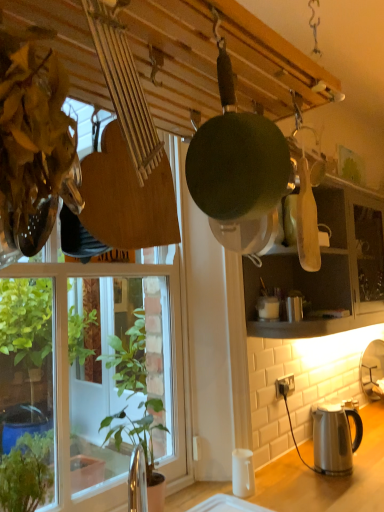
What are the coordinates of `white matte coffee cup at lower right` in the screenshot? It's located at (243, 473).

Measure the distance between satin silver kettle at lower right and camera.

They are 1.62 meters apart.

The image size is (384, 512). What do you see at coordinates (82, 376) in the screenshot? I see `transparent glass window at upper left` at bounding box center [82, 376].

In order to click on green leafy plant at lower left, acting as the first houseplant starting from the front in this screenshot , I will do `click(27, 473)`.

Is matte white cabinet at upper right located outside green matte frying pan at center?

Indeed, matte white cabinet at upper right is completely outside green matte frying pan at center.

Considering the points (273, 282) and (229, 170), which point is in front, point (273, 282) or point (229, 170)?

Positioned in front is point (229, 170).

Is matte white cabinet at upper right turned away from green matte frying pan at center?

No.

Is matte white cabinet at upper right in contact with green matte frying pan at center?

No, matte white cabinet at upper right is not beside green matte frying pan at center.

Is satin silver kettle at lower right touching white matte coffee cup at lower right?

No.

Is satin silver kettle at lower right not within white matte coffee cup at lower right?

That's correct, satin silver kettle at lower right is outside of white matte coffee cup at lower right.

Find the location of a particular element. The height and width of the screenshot is (512, 384). coffee cup located underneath the satin silver kettle at lower right (from a real-world perspective) is located at coordinates (243, 473).

From a real-world perspective, is satin silver kettle at lower right beneath white matte coffee cup at lower right?

Actually, satin silver kettle at lower right is physically above white matte coffee cup at lower right in the real world.

Does satin silver kettle at lower right appear on the right side of white plastic power outlet at lower right?

Correct, you'll find satin silver kettle at lower right to the right of white plastic power outlet at lower right.

Is satin silver kettle at lower right outside of white plastic power outlet at lower right?

Yes, satin silver kettle at lower right is outside of white plastic power outlet at lower right.

Considering the sizes of satin silver kettle at lower right and white plastic power outlet at lower right in the image, is satin silver kettle at lower right wider or thinner than white plastic power outlet at lower right?

satin silver kettle at lower right is wider than white plastic power outlet at lower right.

From the image's perspective, is satin silver kettle at lower right above white plastic power outlet at lower right?

No, from the image's perspective, satin silver kettle at lower right is not over white plastic power outlet at lower right.

Considering the sizes of objects transparent glass window at upper left and matte white cabinet at upper right in the image provided, who is taller, transparent glass window at upper left or matte white cabinet at upper right?

Standing taller between the two is transparent glass window at upper left.

In the image, there is a matte white cabinet at upper right. Where is `window below it (from the image's perspective)`? window below it (from the image's perspective) is located at coordinates (82, 376).

From a real-world perspective, which is physically above, transparent glass window at upper left or matte white cabinet at upper right?

matte white cabinet at upper right, from a real-world perspective.

Considering the positions of point (50, 345) and point (343, 286), is point (50, 345) closer or farther from the camera than point (343, 286)?

Point (50, 345) is positioned farther from the camera compared to point (343, 286).

Which object is thinner, green leafy plant at left, positioned as the second houseplant in front-to-back order, or matte white cabinet at upper right?

Thinner between the two is green leafy plant at left, positioned as the second houseplant in front-to-back order.

Based on their positions, is green leafy plant at left, which ranks as the first houseplant in back-to-front order, located to the left or right of matte white cabinet at upper right?

Based on their positions, green leafy plant at left, which ranks as the first houseplant in back-to-front order, is located to the left of matte white cabinet at upper right.

Is point (128, 361) closer or farther from the camera than point (358, 257)?

Point (128, 361) is positioned farther from the camera compared to point (358, 257).

Does green leafy plant at left, marked as the 1th houseplant in a right-to-left arrangement, have a larger size compared to matte white cabinet at upper right?

No.

Does white matte coffee cup at lower right have a larger size compared to matte white cabinet at upper right?

No, white matte coffee cup at lower right is not bigger than matte white cabinet at upper right.

Can you confirm if white matte coffee cup at lower right is wider than matte white cabinet at upper right?

In fact, white matte coffee cup at lower right might be narrower than matte white cabinet at upper right.

From a real-world perspective, who is located higher, transparent glass window at upper left or white matte coffee cup at lower right?

transparent glass window at upper left, from a real-world perspective.

Which is in front, transparent glass window at upper left or white matte coffee cup at lower right?

transparent glass window at upper left.

Is transparent glass window at upper left oriented towards white matte coffee cup at lower right?

Yes, transparent glass window at upper left faces towards white matte coffee cup at lower right.

Are transparent glass window at upper left and white matte coffee cup at lower right beside each other?

transparent glass window at upper left and white matte coffee cup at lower right are clearly separated.

Identify the location of frying pan lying above the matte white cabinet at upper right (from the image's perspective). (236, 158).

Where is `coffee cup in front of the satin silver kettle at lower right`? coffee cup in front of the satin silver kettle at lower right is located at coordinates (243, 473).

From the image, which object appears to be nearer to green leafy plant at lower left, the second houseplant when ordered from back to front, white plastic power outlet at lower right or white matte coffee cup at lower right?

The object closer to green leafy plant at lower left, the second houseplant when ordered from back to front, is white matte coffee cup at lower right.

Based on their spatial positions, is green matte frying pan at center or green leafy plant at lower left, which appears as the first houseplant when viewed from the left, closer to transparent glass window at upper left?

green leafy plant at lower left, which appears as the first houseplant when viewed from the left.

Based on the photo, considering their positions, is matte white cabinet at upper right positioned further to transparent glass window at upper left than white matte coffee cup at lower right?

Among the two, white matte coffee cup at lower right is located further to transparent glass window at upper left.

Considering their positions, is green leafy plant at left, which ranks as the first houseplant in back-to-front order, positioned closer to white matte coffee cup at lower right than white plastic power outlet at lower right?

Among the two, white plastic power outlet at lower right is located nearer to white matte coffee cup at lower right.

Looking at the image, which one is located further to green leafy plant at lower left, which appears as the first houseplant when viewed from the left, matte white cabinet at upper right or white plastic power outlet at lower right?

matte white cabinet at upper right is further to green leafy plant at lower left, which appears as the first houseplant when viewed from the left.

From the image, which object appears to be farther from matte white cabinet at upper right, green matte frying pan at center or green leafy plant at lower left, acting as the first houseplant starting from the front?

green leafy plant at lower left, acting as the first houseplant starting from the front, is positioned further to the anchor matte white cabinet at upper right.

When comparing their distances from white matte coffee cup at lower right, does green matte frying pan at center or green leafy plant at left, which ranks as the first houseplant in back-to-front order, seem closer?

green leafy plant at left, which ranks as the first houseplant in back-to-front order, is closer to white matte coffee cup at lower right.

Consider the image. Estimate the real-world distances between objects in this image. Which object is further from white matte coffee cup at lower right, transparent glass window at upper left or white plastic power outlet at lower right?

Among the two, transparent glass window at upper left is located further to white matte coffee cup at lower right.

In order to click on window between green matte frying pan at center and green leafy plant at left, arranged as the second houseplant when viewed from the left, in the vertical direction in this screenshot , I will do `click(82, 376)`.

Where is `kettle between green matte frying pan at center and white plastic power outlet at lower right from front to back`? kettle between green matte frying pan at center and white plastic power outlet at lower right from front to back is located at coordinates (334, 438).

Image resolution: width=384 pixels, height=512 pixels. I want to click on power outlet that lies between matte white cabinet at upper right and white matte coffee cup at lower right from top to bottom, so click(285, 386).

This screenshot has height=512, width=384. Find the location of `power outlet between green leafy plant at lower left, the second houseplant when ordered from back to front, and satin silver kettle at lower right, in the horizontal direction`. power outlet between green leafy plant at lower left, the second houseplant when ordered from back to front, and satin silver kettle at lower right, in the horizontal direction is located at coordinates (285, 386).